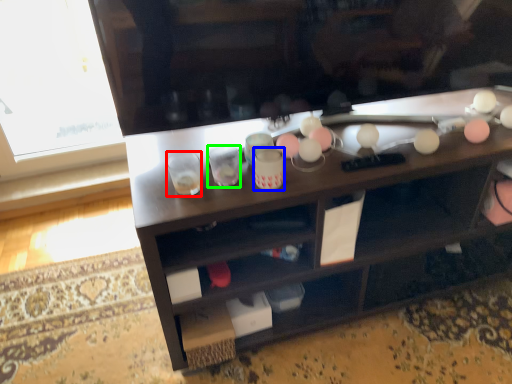
Question: Based on their relative distances, which object is nearer to shot glass (highlighted by a red box)? Choose from beverage (highlighted by a blue box) and shot glass (highlighted by a green box).

Choices:
 (A) beverage
 (B) shot glass

Answer: (B)